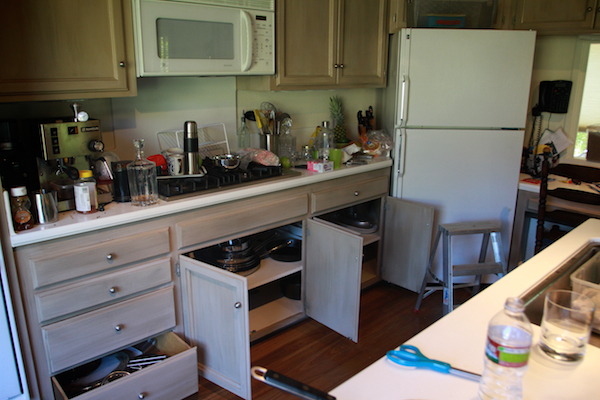
The image size is (600, 400). I want to click on thermos, so pyautogui.click(x=186, y=125), pyautogui.click(x=192, y=126), pyautogui.click(x=194, y=139), pyautogui.click(x=196, y=162), pyautogui.click(x=188, y=169), pyautogui.click(x=195, y=171), pyautogui.click(x=186, y=144).